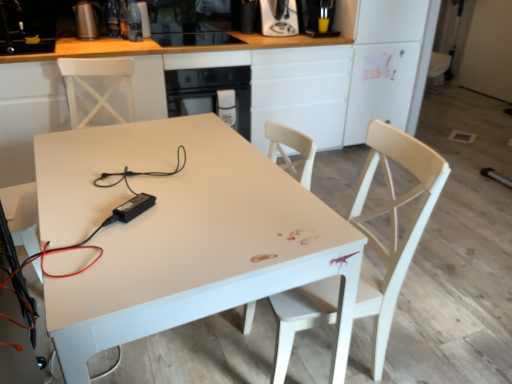
Identify the location of vacant area that is in front of black plastic power adapter at center, the 1th appliance in the right-to-left sequence. (117, 245).